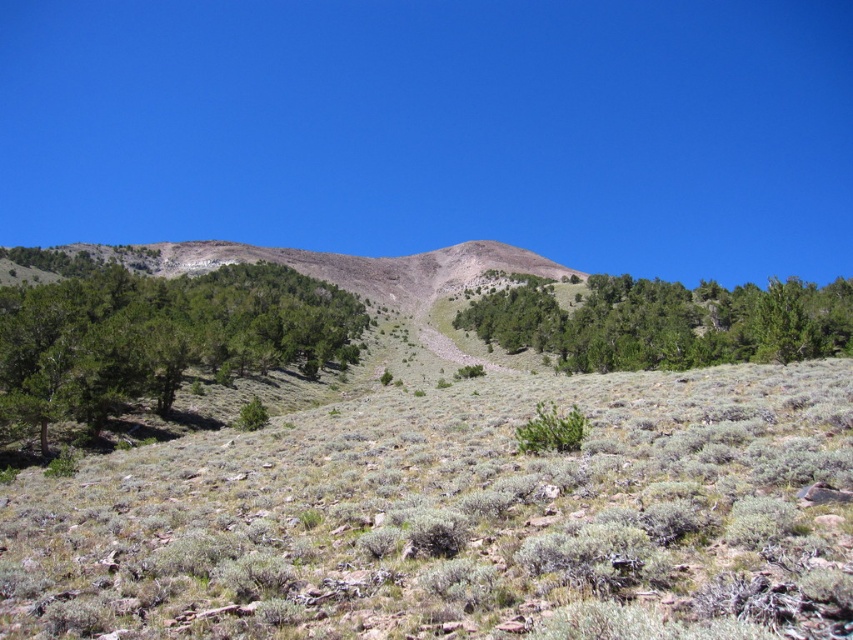
You are standing in the middle of the open landscape described. You see a point marked at coordinates (157, 339). What object is located at this point?

The point at coordinates (157, 339) corresponds to the green leafy tree at center left.